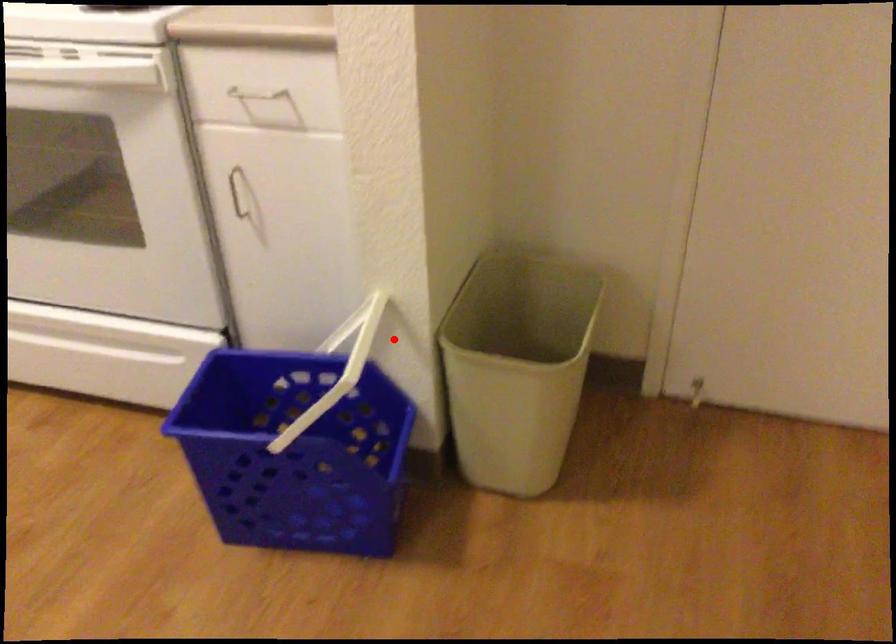
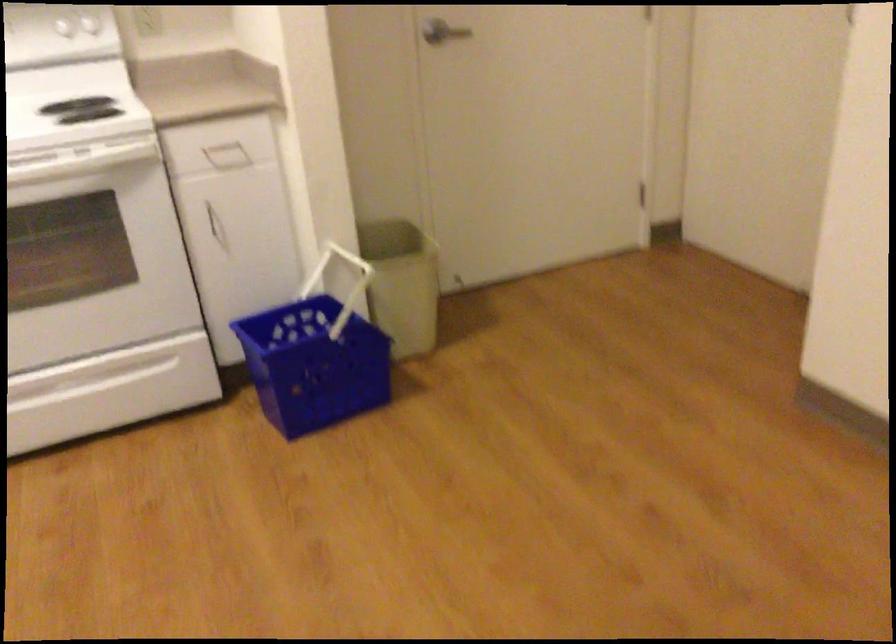
Question: I am providing you with two images of the same scene from different viewpoints. A red point is shown in image1. For the corresponding object point in image2, is it positioned nearer or farther from the camera?

Choices:
 (A) Nearer
 (B) Farther

Answer: (B)